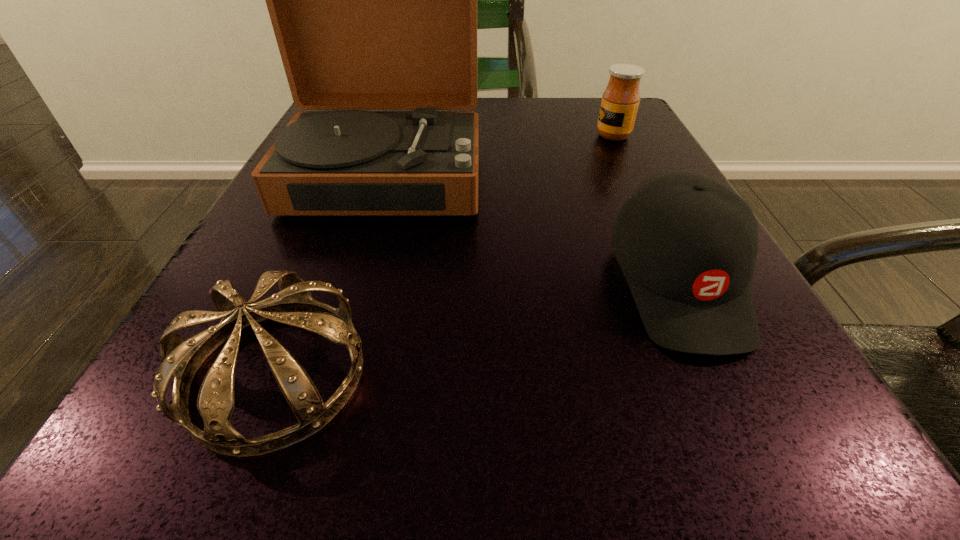
Locate an element on the screen. Image resolution: width=960 pixels, height=540 pixels. free location at the far edge of the desktop is located at coordinates (519, 145).

This screenshot has height=540, width=960. I want to click on free space at the near edge of the desktop, so click(x=647, y=485).

Identify the location of vacant space at the right edge of the desktop. (586, 148).

At what (x,y) coordinates should I click in order to perform the action: click on vacant area at the near left corner of the desktop. Please return your answer as a coordinate pair (x, y). Looking at the image, I should click on (279, 451).

In order to click on vacant region at the far right corner in this screenshot , I will do `click(579, 122)`.

In the image, there is a desktop. At what (x,y) coordinates should I click in order to perform the action: click on vacant space at the near right corner. Please return your answer as a coordinate pair (x, y). The height and width of the screenshot is (540, 960). Looking at the image, I should click on (739, 455).

Locate an element on the screen. The height and width of the screenshot is (540, 960). free area in between the tiara and the baseball cap is located at coordinates (477, 328).

Where is `vacant area that lies between the tiara and the baseball cap`? This screenshot has width=960, height=540. vacant area that lies between the tiara and the baseball cap is located at coordinates (477, 328).

At what (x,y) coordinates should I click in order to perform the action: click on vacant area that lies between the phonograph record and the baseball cap. Please return your answer as a coordinate pair (x, y). This screenshot has width=960, height=540. Looking at the image, I should click on (532, 228).

Image resolution: width=960 pixels, height=540 pixels. What are the coordinates of `unoccupied position between the baseball cap and the tiara` in the screenshot? It's located at (477, 328).